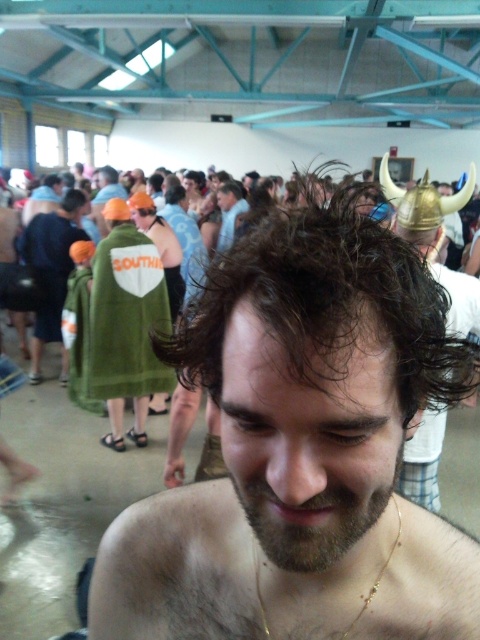
Question: Does brown curly hair at center appear under orange fabric at left?

Choices:
 (A) no
 (B) yes

Answer: (B)

Question: Which point is closer to the camera?

Choices:
 (A) orange fabric headband at upper center
 (B) brown fuzzy beard at center

Answer: (B)

Question: Is the position of brown fuzzy beard at center more distant than that of matte black helmet at upper center?

Choices:
 (A) no
 (B) yes

Answer: (A)

Question: Observing the image, what is the correct spatial positioning of orange foam helmet at upper left in reference to orange fabric cap at upper left?

Choices:
 (A) right
 (B) left

Answer: (B)

Question: Estimate the real-world distances between objects in this image. Which object is farther from the orange fabric at left?

Choices:
 (A) gold metallic helmet at upper right
 (B) brown curly hair at center
 (C) brown fuzzy beard at center
 (D) orange fabric headband at upper center

Answer: (C)

Question: Which object is farther from the camera taking this photo?

Choices:
 (A) orange fabric cap at upper left
 (B) gold metallic helmet at upper right
 (C) orange foam helmet at upper left
 (D) dark brown curly hair at center

Answer: (C)